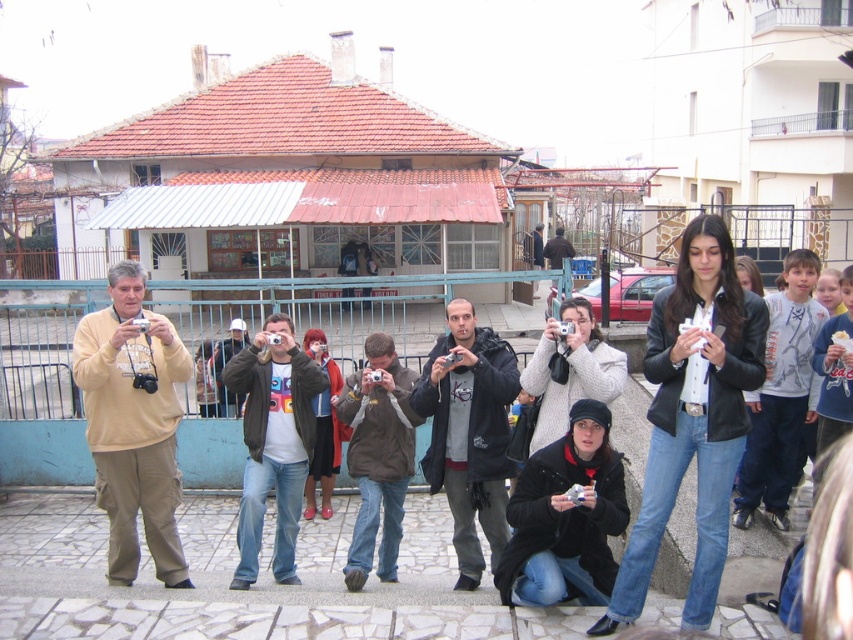
Question: Which object is the farthest from the beige fleece jacket at center?

Choices:
 (A) dark gray jacket at center
 (B) white t-shirt at center
 (C) matte black jacket at center

Answer: (C)

Question: Which point appears farthest from the camera in this image?

Choices:
 (A) (440, 422)
 (B) (730, 266)
 (C) (112, 573)

Answer: (A)

Question: Which is nearer to the matte black jacket at center?

Choices:
 (A) dark gray jacket at center
 (B) white t-shirt at center
 (C) beige fleece jacket at center

Answer: (A)

Question: Is beige fleece jacket at center further to the viewer compared to dark gray jacket at center?

Choices:
 (A) yes
 (B) no

Answer: (B)

Question: From the image, what is the correct spatial relationship of beige fleece jacket at center in relation to white t-shirt at center?

Choices:
 (A) above
 (B) below

Answer: (A)

Question: Is dark gray jacket at center positioned before white t-shirt at center?

Choices:
 (A) yes
 (B) no

Answer: (B)